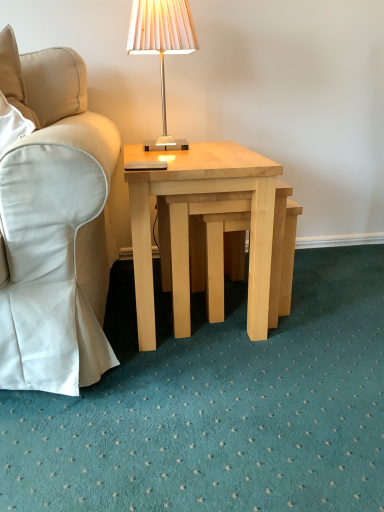
Locate an element on the screen. Image resolution: width=384 pixels, height=512 pixels. blank space situated above light wood/natural wood coffee table at center (from a real-world perspective) is located at coordinates (196, 148).